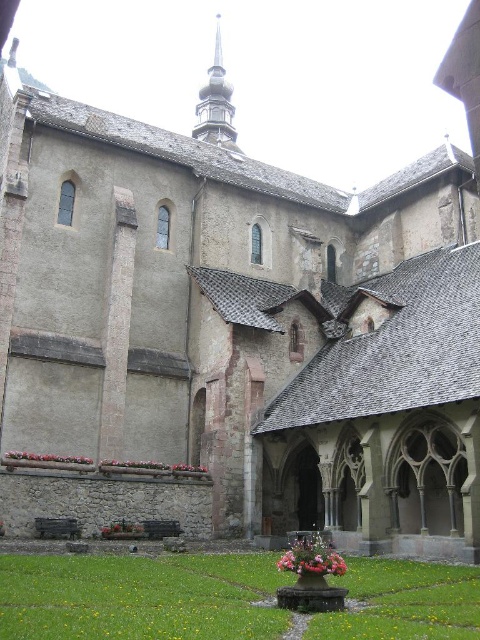
Question: Does pink floral bouquet at center appear under pink fabric flower at lower center?

Choices:
 (A) yes
 (B) no

Answer: (A)

Question: Does smooth gold spire at upper center appear on the right side of pink floral bouquet at center?

Choices:
 (A) yes
 (B) no

Answer: (B)

Question: Which point is farther to the camera?

Choices:
 (A) pink floral bouquet at center
 (B) pink fabric flower at lower center

Answer: (B)

Question: Is the position of smooth gold spire at upper center more distant than that of pink fabric flower at lower center?

Choices:
 (A) no
 (B) yes

Answer: (B)

Question: Among these points, which one is nearest to the camera?

Choices:
 (A) (70, 458)
 (B) (214, 106)

Answer: (A)

Question: Which object is the closest to the smooth gold spire at upper center?

Choices:
 (A) pink fabric flower at lower center
 (B) pink floral bouquet at center

Answer: (A)